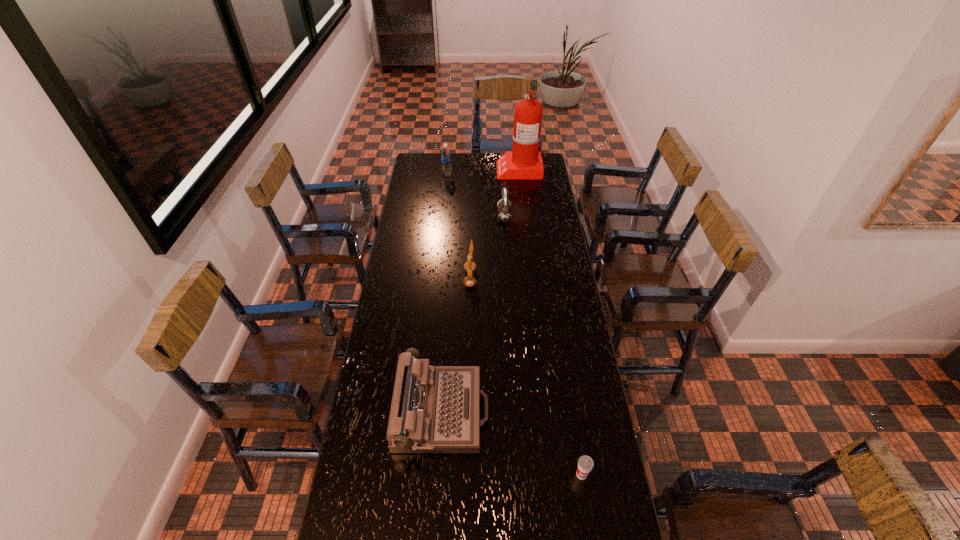
Identify the location of free spot located on the front-facing side of the fire extinguisher. (463, 168).

Locate an element on the screen. The height and width of the screenshot is (540, 960). free space located on the front-facing side of the fire extinguisher is located at coordinates (452, 168).

The height and width of the screenshot is (540, 960). I want to click on vacant space located on the right of the water bottle, so click(x=510, y=175).

Locate an element on the screen. Image resolution: width=960 pixels, height=540 pixels. free region located on the ear pads of the farther earphone is located at coordinates (471, 217).

The image size is (960, 540). What are the coordinates of `vacant region located 0.160m on the ear pads of the farther earphone` in the screenshot? It's located at (466, 217).

The width and height of the screenshot is (960, 540). Find the location of `vacant space situated on the ear pads of the farther earphone`. vacant space situated on the ear pads of the farther earphone is located at coordinates (443, 217).

Where is `blank space located on the front-facing side of the left earphone`? This screenshot has width=960, height=540. blank space located on the front-facing side of the left earphone is located at coordinates (531, 278).

Identify the location of free region located on the keyboard of the typewriter. The image size is (960, 540). (503, 412).

Locate an element on the screen. This screenshot has height=540, width=960. free spot located on the side of the shortest object with the logo is located at coordinates (586, 500).

I want to click on fire extinguisher situated at the far edge, so click(x=524, y=161).